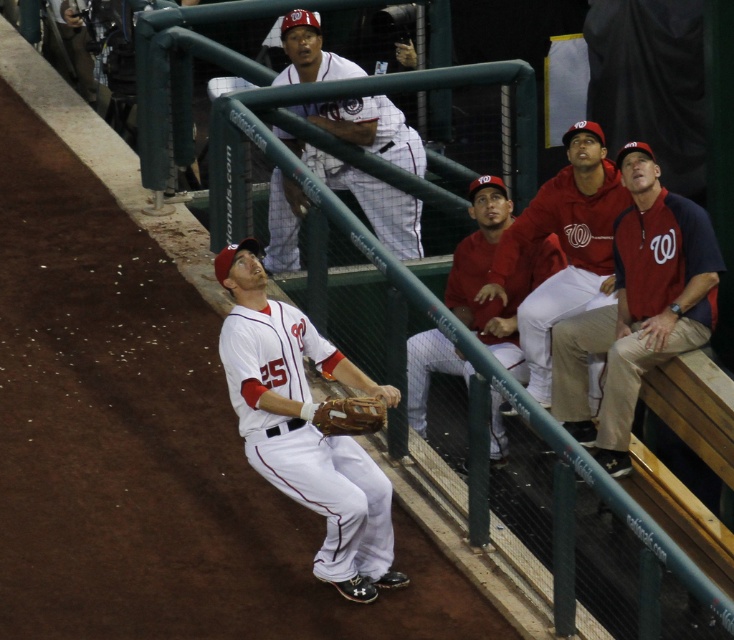
Question: Does green metal rail at upper center appear under red fabric jacket at upper right?

Choices:
 (A) yes
 (B) no

Answer: (B)

Question: Is white matte baseball glove at center to the left of matte red jersey at center from the viewer's perspective?

Choices:
 (A) yes
 (B) no

Answer: (A)

Question: Does red fabric jacket at upper right come behind brown leather glove at center?

Choices:
 (A) no
 (B) yes

Answer: (B)

Question: Which of these objects is positioned farthest from the brown leather glove at center?

Choices:
 (A) white matte baseball glove at center
 (B) white mesh uniform at upper center

Answer: (B)

Question: Which of the following is the farthest from the observer?

Choices:
 (A) brown leather glove at center
 (B) white matte baseball glove at center

Answer: (B)

Question: Which object is farther from the camera taking this photo?

Choices:
 (A) brown leather glove at center
 (B) matte red jersey at center

Answer: (B)